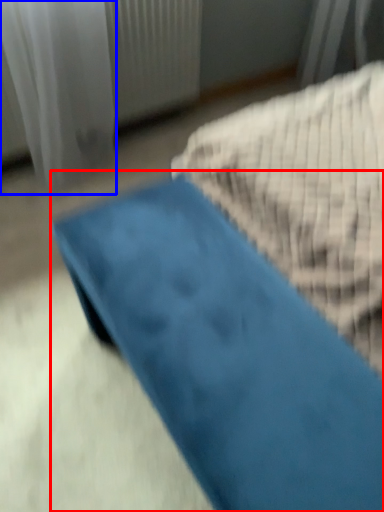
Question: Among these objects, which one is farthest to the camera, furniture (highlighted by a red box) or curtain (highlighted by a blue box)?

Choices:
 (A) furniture
 (B) curtain

Answer: (B)